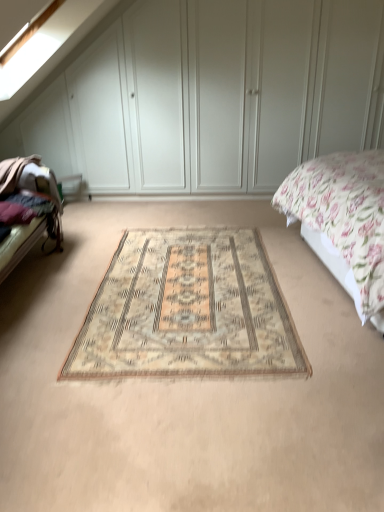
Question: Do you think white matte wardrobe at center is within dark brown fabric bed frame at left, or outside of it?

Choices:
 (A) outside
 (B) inside

Answer: (A)

Question: Is point (175, 159) closer or farther from the camera than point (1, 170)?

Choices:
 (A) farther
 (B) closer

Answer: (A)

Question: Considering the real-world distances, which object is farthest from the white matte wardrobe at center?

Choices:
 (A) beige woven rug at center
 (B) floral fabric bed at right
 (C) dark brown fabric bed frame at left
 (D) beige carpet at center

Answer: (D)

Question: Considering the real-world distances, which object is farthest from the floral fabric bed at right?

Choices:
 (A) beige carpet at center
 (B) dark brown fabric bed frame at left
 (C) white matte wardrobe at center
 (D) beige woven rug at center

Answer: (B)